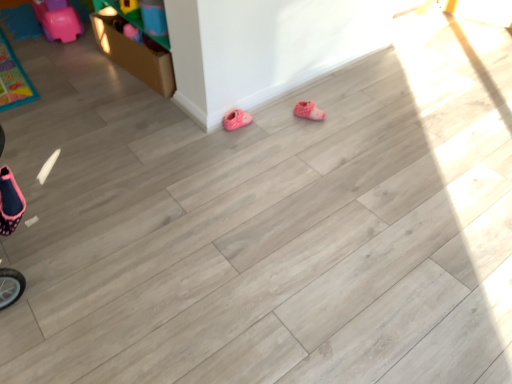
Question: Does pink polka dot fabric booties at center, the first footwear from the right, have a lesser width compared to pink fabric slipper at lower center, the 1th footwear from the left?

Choices:
 (A) no
 (B) yes

Answer: (A)

Question: Is the depth of pink polka dot fabric booties at center, positioned as the second footwear in left-to-right order, greater than that of pink fabric slipper at lower center, the 1th footwear from the left?

Choices:
 (A) yes
 (B) no

Answer: (A)

Question: Is pink polka dot fabric booties at center, positioned as the second footwear in left-to-right order, bigger than pink fabric slipper at lower center, the 1th footwear from the left?

Choices:
 (A) no
 (B) yes

Answer: (A)

Question: From a real-world perspective, is pink polka dot fabric booties at center, the first footwear from the right, on top of pink fabric slipper at lower center, the 1th footwear from the left?

Choices:
 (A) no
 (B) yes

Answer: (B)

Question: Does pink polka dot fabric booties at center, the first footwear from the right, appear on the right side of pink fabric slipper at lower center, the 1th footwear from the left?

Choices:
 (A) yes
 (B) no

Answer: (A)

Question: From the image's perspective, is pink polka dot fabric booties at center, the first footwear from the right, below pink fabric slipper at lower center, the 1th footwear from the left?

Choices:
 (A) yes
 (B) no

Answer: (B)

Question: Is pink fabric slipper at lower center, the 1th footwear from the left, smaller than pink polka dot fabric booties at center, positioned as the second footwear in left-to-right order?

Choices:
 (A) no
 (B) yes

Answer: (A)

Question: Can you see pink fabric slipper at lower center, which ranks as the second footwear in right-to-left order, touching pink polka dot fabric booties at center, positioned as the second footwear in left-to-right order?

Choices:
 (A) no
 (B) yes

Answer: (A)

Question: Considering the relative sizes of pink fabric slipper at lower center, which ranks as the second footwear in right-to-left order, and pink polka dot fabric booties at center, positioned as the second footwear in left-to-right order, in the image provided, is pink fabric slipper at lower center, which ranks as the second footwear in right-to-left order, thinner than pink polka dot fabric booties at center, positioned as the second footwear in left-to-right order,?

Choices:
 (A) no
 (B) yes

Answer: (B)

Question: Does pink fabric slipper at lower center, the 1th footwear from the left, have a greater width compared to pink polka dot fabric booties at center, the first footwear from the right?

Choices:
 (A) yes
 (B) no

Answer: (B)

Question: Are pink fabric slipper at lower center, which ranks as the second footwear in right-to-left order, and pink polka dot fabric booties at center, positioned as the second footwear in left-to-right order, located far from each other?

Choices:
 (A) no
 (B) yes

Answer: (A)

Question: From the image's perspective, is pink fabric slipper at lower center, which ranks as the second footwear in right-to-left order, on top of pink polka dot fabric booties at center, the first footwear from the right?

Choices:
 (A) yes
 (B) no

Answer: (B)

Question: From a real-world perspective, relative to pink fabric slipper at lower center, the 1th footwear from the left, is pink polka dot fabric booties at center, positioned as the second footwear in left-to-right order, vertically above or below?

Choices:
 (A) above
 (B) below

Answer: (A)